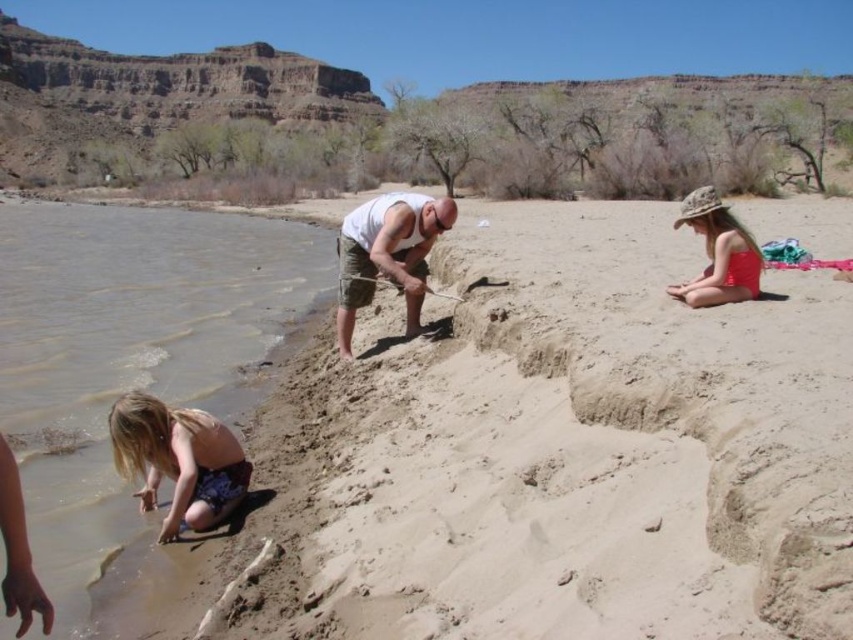
Question: Is the position of blonde hair girl at lower left less distant than that of white tank top at center?

Choices:
 (A) no
 (B) yes

Answer: (B)

Question: Is blonde hair girl at lower left below white tank top at center?

Choices:
 (A) yes
 (B) no

Answer: (A)

Question: Where is clear water at lower left located in relation to blonde hair girl at lower left in the image?

Choices:
 (A) below
 (B) above

Answer: (B)

Question: Which point is farther to the camera?

Choices:
 (A) clear water at lower left
 (B) matte pink swimsuit at right
 (C) blonde hair girl at lower left
 (D) white tank top at center

Answer: (D)

Question: Which object appears closest to the camera in this image?

Choices:
 (A) matte pink swimsuit at right
 (B) clear water at lower left
 (C) white tank top at center

Answer: (B)

Question: Which object is positioned farthest from the clear water at lower left?

Choices:
 (A) white tank top at center
 (B) matte pink swimsuit at right

Answer: (B)